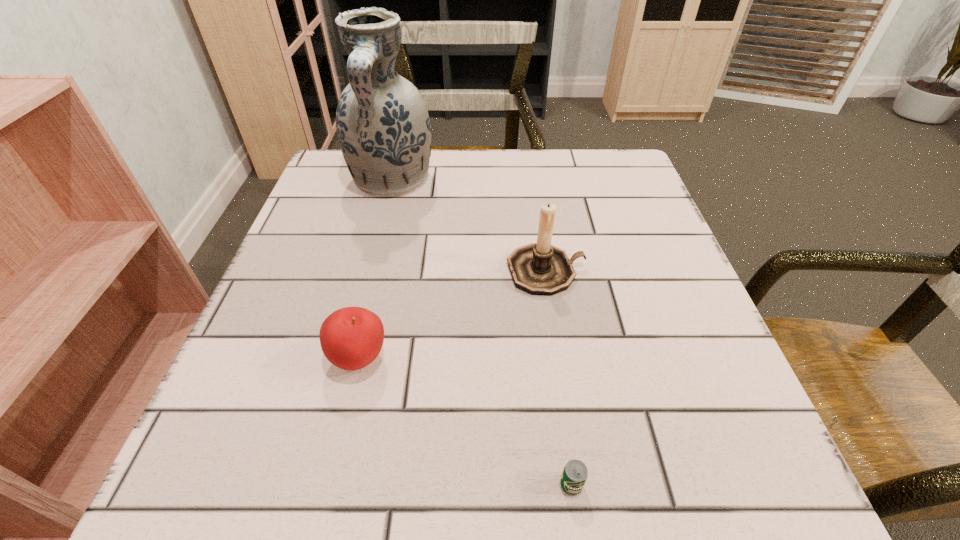
Locate an element on the screen. vacant region located 0.390m on the back of the third tallest object is located at coordinates (396, 196).

Image resolution: width=960 pixels, height=540 pixels. In order to click on vacant position located 0.100m on the left of the beer can in this screenshot , I will do `click(444, 485)`.

Locate an element on the screen. object that is at the far edge is located at coordinates tap(384, 131).

The width and height of the screenshot is (960, 540). Identify the location of object that is at the near edge. click(x=574, y=476).

The height and width of the screenshot is (540, 960). In order to click on vase present at the left edge in this screenshot , I will do `click(384, 131)`.

Locate an element on the screen. apple located in the left edge section of the desktop is located at coordinates (351, 338).

Where is `object situated at the far left corner`? This screenshot has height=540, width=960. object situated at the far left corner is located at coordinates (384, 131).

Where is `free space at the far edge of the desktop`? The image size is (960, 540). free space at the far edge of the desktop is located at coordinates (573, 205).

This screenshot has width=960, height=540. What are the coordinates of `vacant point at the near edge` in the screenshot? It's located at (516, 467).

You are a GUI agent. You are given a task and a screenshot of the screen. Output one action in this format:
    pyautogui.click(x=<x>, y=<y>)
    Task: Click on the vacant space at the left edge of the desktop
    
    Given the screenshot: What is the action you would take?
    pyautogui.click(x=278, y=413)